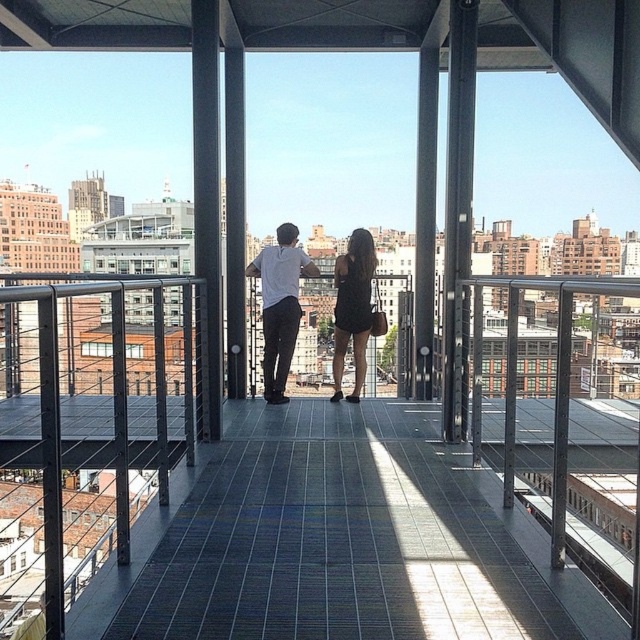
Question: Which point is farther from the camera taking this photo?

Choices:
 (A) (268, 378)
 (B) (333, 396)

Answer: (B)

Question: Based on their relative distances, which object is nearer to the metallic gray balcony at center?

Choices:
 (A) black matte dress at center
 (B) white matte shirt at center

Answer: (B)

Question: Which object is the closest to the black matte dress at center?

Choices:
 (A) white matte shirt at center
 (B) metallic gray balcony at center

Answer: (A)

Question: Does white matte shirt at center appear on the right side of black matte dress at center?

Choices:
 (A) yes
 (B) no

Answer: (B)

Question: Does metallic gray balcony at center appear on the right side of white matte shirt at center?

Choices:
 (A) no
 (B) yes

Answer: (B)

Question: Where is white matte shirt at center located in relation to black matte dress at center in the image?

Choices:
 (A) above
 (B) below

Answer: (A)